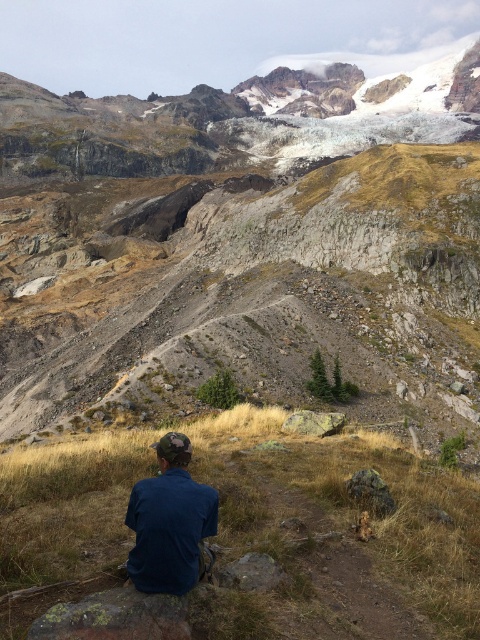
Is point (399, 632) in front of point (160, 476)?

Yes, point (399, 632) is in front of point (160, 476).

Which of these two, brown grassy hillside at lower center or blue denim shirt at lower center, stands shorter?

brown grassy hillside at lower center

Which is behind, point (384, 544) or point (159, 564)?

The point (384, 544) is more distant.

Where is `brown grassy hillside at lower center`? brown grassy hillside at lower center is located at coordinates (334, 536).

Does rugged rock mountain at center appear on the left side of blue denim shirt at lower center?

Indeed, rugged rock mountain at center is positioned on the left side of blue denim shirt at lower center.

Who is taller, rugged rock mountain at center or blue denim shirt at lower center?

rugged rock mountain at center is taller.

The image size is (480, 640). What do you see at coordinates (238, 234) in the screenshot?
I see `rugged rock mountain at center` at bounding box center [238, 234].

Locate an element on the screen. rugged rock mountain at center is located at coordinates (238, 234).

How distant is rugged rock mountain at center from brown grassy hillside at lower center?

They are 103.26 meters apart.

Can you confirm if rugged rock mountain at center is smaller than brown grassy hillside at lower center?

Incorrect, rugged rock mountain at center is not smaller in size than brown grassy hillside at lower center.

Is point (199, 147) positioned before point (73, 563)?

That is False.

You are a GUI agent. You are given a task and a screenshot of the screen. Output one action in this format:
    pyautogui.click(x=<x>, y=<y>)
    Task: Click on the rugged rock mountain at center
    This screenshot has width=480, height=640.
    Given the screenshot: What is the action you would take?
    pyautogui.click(x=238, y=234)